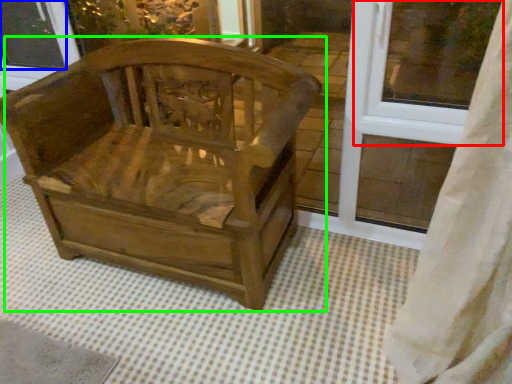
Question: Which object is the farthest from window frame (highlighted by a red box)? Choose among these: window screen (highlighted by a blue box) or chair (highlighted by a green box).

Choices:
 (A) window screen
 (B) chair

Answer: (A)